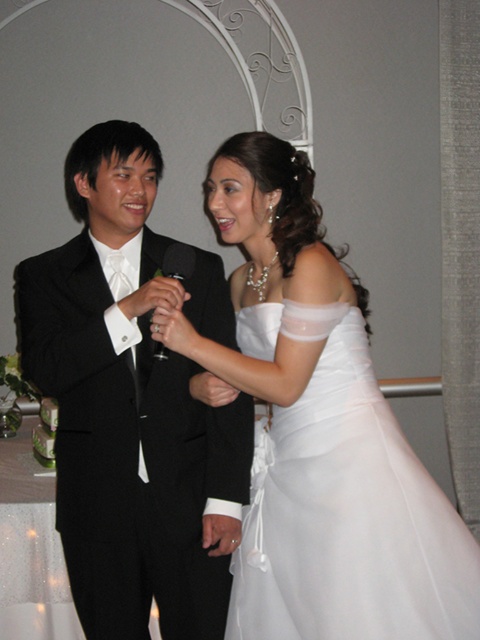
Question: Is black satin suit at left to the right of white satin dress at center from the viewer's perspective?

Choices:
 (A) no
 (B) yes

Answer: (A)

Question: Can you confirm if black satin suit at left is thinner than white satin dress at center?

Choices:
 (A) no
 (B) yes

Answer: (A)

Question: Can you confirm if black satin suit at left is wider than white satin dress at center?

Choices:
 (A) no
 (B) yes

Answer: (B)